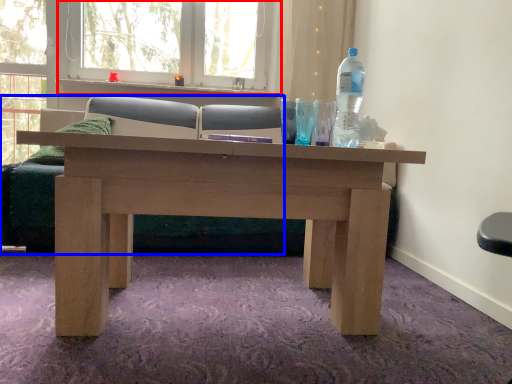
Question: Which of the following is the farthest to the observer, window frame (highlighted by a red box) or studio couch (highlighted by a blue box)?

Choices:
 (A) window frame
 (B) studio couch

Answer: (A)